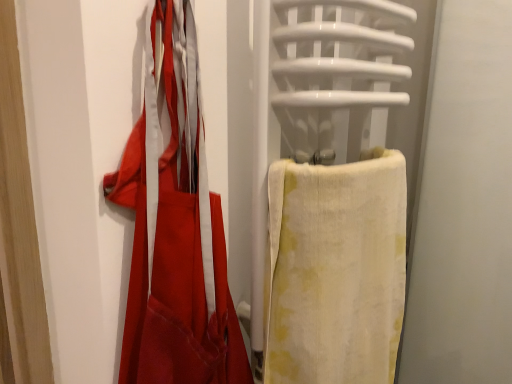
What do you see at coordinates (336, 270) in the screenshot?
I see `white corduroy towel at center` at bounding box center [336, 270].

What are the coordinates of `white corduroy towel at center` in the screenshot? It's located at [x=336, y=270].

The width and height of the screenshot is (512, 384). What are the coordinates of `white corduroy towel at center` in the screenshot? It's located at (336, 270).